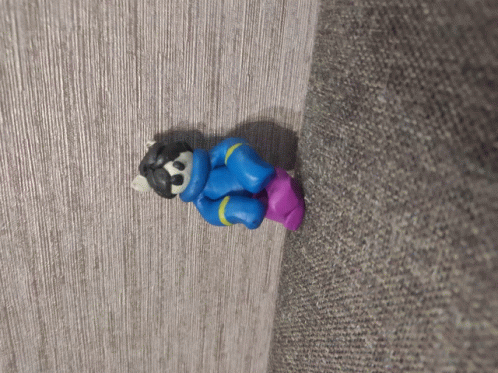
The width and height of the screenshot is (498, 373). Identify the location of sculpture. (229, 209).